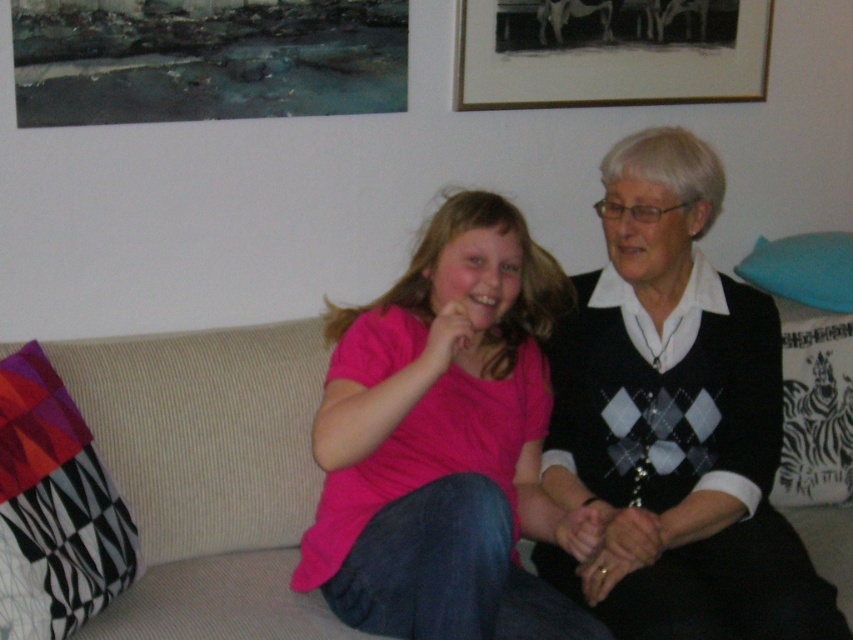
You are a photographer trying to capture a candid shot of the two people on the beige sofa. The pink matte shirt at center and the black matte picture frame at upper center are both in your viewfinder. Which object is positioned higher in the frame?

The pink matte shirt at center is taller than the black matte picture frame at upper center, so the pink matte shirt at center is positioned higher in the frame.

From the picture: You are a photographer setting up a shot of the two people on the beige sofa. The pink matte shirt at center and the black matte picture frame at upper center are both in your viewfinder. You want to ensure that the distance between them in the photo is exactly 85 centimeters. Is this achievable with your current setup?

The pink matte shirt at center is 84.95 centimeters from the black matte picture frame at upper center, so the distance is already very close to 85 centimeters. With minor adjustments, achieving the desired distance is possible.

Where is the black sweater at right located in the image?

The black sweater at right is located at point 0.659 on the x axis and 0.791 on the y axis.